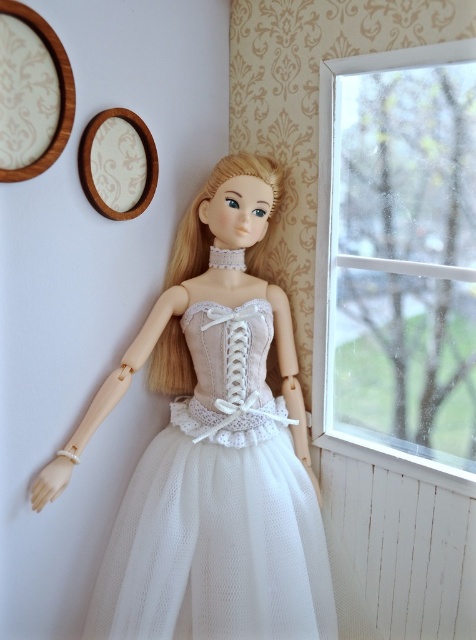
You are a photographer setting up a shoot in the room where the doll is placed. You need to position a light source to the right of the white wood at lower right. Will the light source be to the right or left of the white tulle dress at center?

The white tulle dress at center is to the left of the white wood at lower right. Therefore, placing the light source to the right of the white wood at lower right would mean it is also to the right of the white tulle dress at center.

Based on the photo, you are standing in front of the doll positioned against the wall with two circular frames. You want to place a small decoration exactly at the point marked as point (136, 611). If you are currently 1.24 meters away from the wall, can you reach the point without moving closer?

The point (136, 611) is 1.24 meters away from the viewer. Since you are already 1.24 meters away from the wall, you can reach the point without moving closer as you are at the correct distance.

You are an interior designer planning to place a new decorative item between the transparent glass window at right and the white tulle dress at center. Considering their widths, which object should the item be placed closer to to ensure it fits better?

The transparent glass window at right has a lesser width compared to the white tulle dress at center, so placing the item closer to the transparent glass window at right would allow it to fit better due to the narrower space available there.